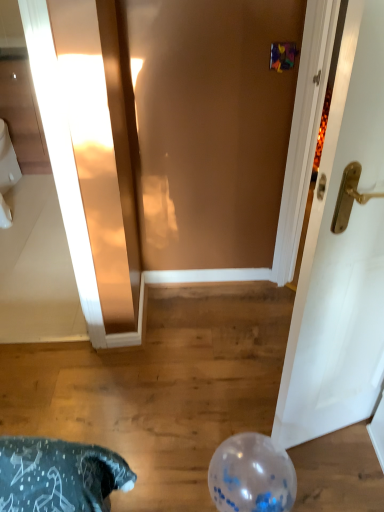
You are a GUI agent. You are given a task and a screenshot of the screen. Output one action in this format:
    pyautogui.click(x=<x>, y=<y>)
    Task: Click on the free space behind transparent plastic balloon at lower center
    The height and width of the screenshot is (512, 384).
    Given the screenshot: What is the action you would take?
    pyautogui.click(x=237, y=423)